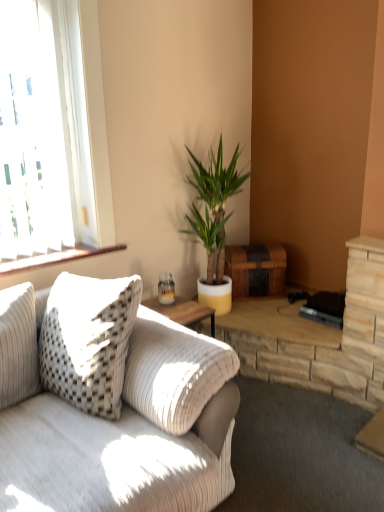
Question: Visually, is clear glass window at upper left positioned to the left or to the right of white corduroy couch at left?

Choices:
 (A) left
 (B) right

Answer: (A)

Question: Looking at their shapes, would you say clear glass window at upper left is wider or thinner than white corduroy couch at left?

Choices:
 (A) wide
 (B) thin

Answer: (B)

Question: Which object is the farthest from the white corduroy couch at left?

Choices:
 (A) wooden at left
 (B) green leafy plant at center
 (C) clear glass window at upper left

Answer: (B)

Question: Considering the real-world distances, which object is farthest from the clear glass window at upper left?

Choices:
 (A) green leafy plant at center
 (B) white corduroy couch at left
 (C) wooden at left

Answer: (B)